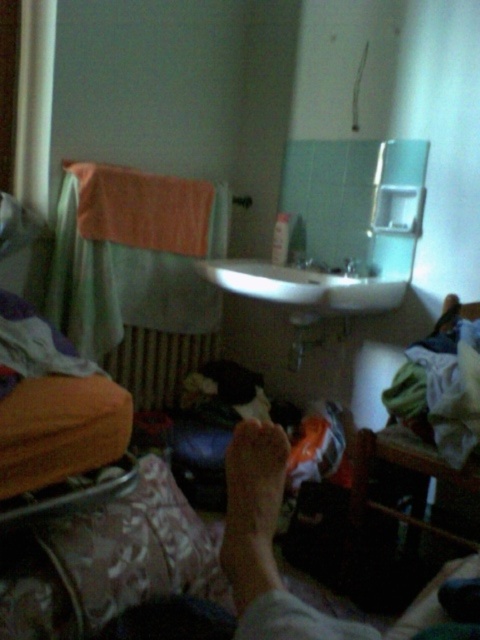
Does light skin tone foot at center appear over white glossy sink at center?

No, light skin tone foot at center is not above white glossy sink at center.

Does light skin tone foot at center have a lesser height compared to white glossy sink at center?

Yes.

This screenshot has height=640, width=480. What do you see at coordinates (252, 508) in the screenshot?
I see `light skin tone foot at center` at bounding box center [252, 508].

The width and height of the screenshot is (480, 640). What are the coordinates of `light skin tone foot at center` in the screenshot? It's located at click(x=252, y=508).

Which is behind, point (339, 301) or point (348, 259)?

Positioned behind is point (348, 259).

Between white glossy sink at center and white glossy faucet at upper center, which one appears on the right side from the viewer's perspective?

white glossy faucet at upper center is more to the right.

Between point (289, 289) and point (350, 266), which one is positioned in front?

Positioned in front is point (289, 289).

I want to click on white glossy sink at center, so click(302, 285).

Does orange towel at left appear on the right side of white glossy faucet at center?

In fact, orange towel at left is to the left of white glossy faucet at center.

Is orange towel at left thinner than white glossy faucet at center?

In fact, orange towel at left might be wider than white glossy faucet at center.

Which is behind, point (121, 300) or point (319, 269)?

The point (319, 269) is behind.

This screenshot has width=480, height=640. I want to click on orange towel at left, so click(133, 253).